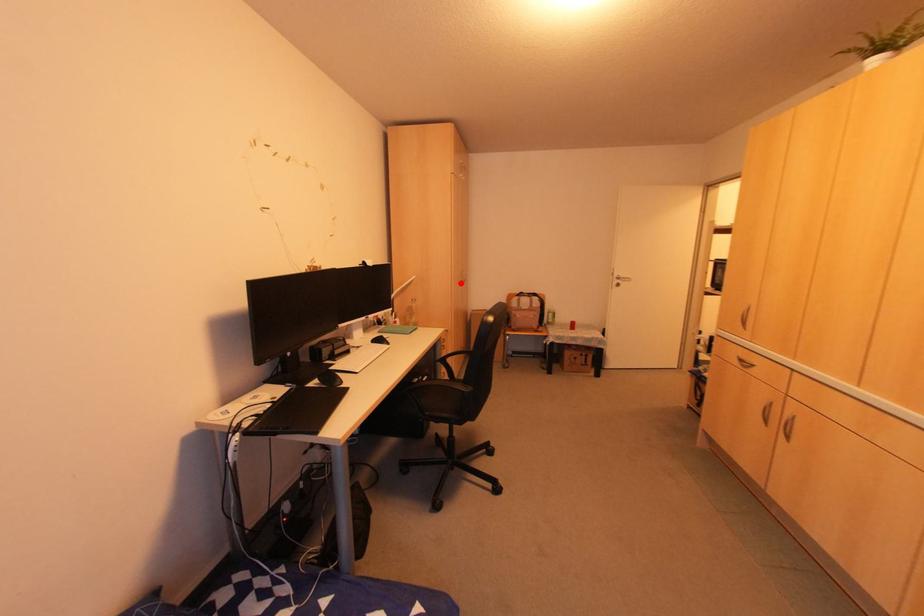
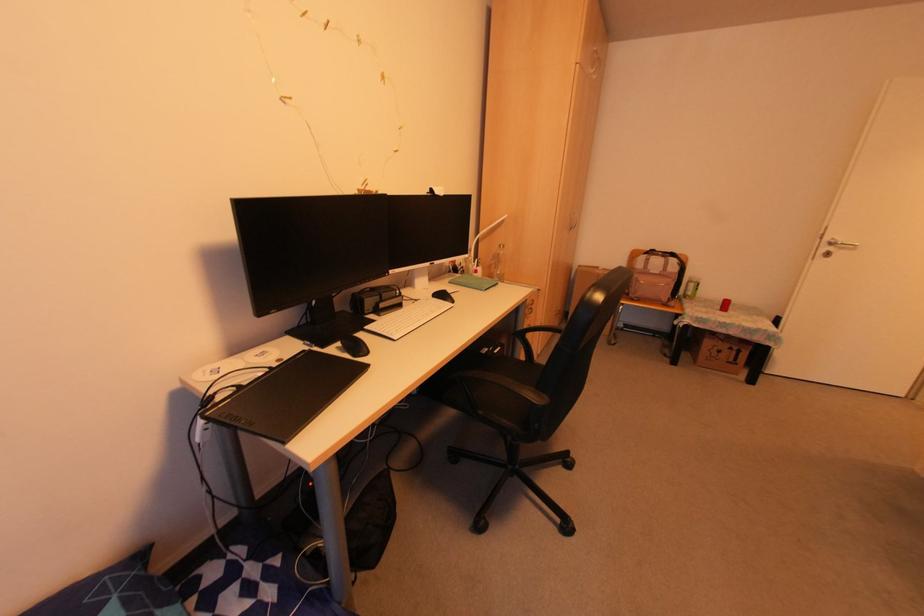
The point at the highlighted location is marked in the first image. Where is the corresponding point in the second image?

(568, 229)